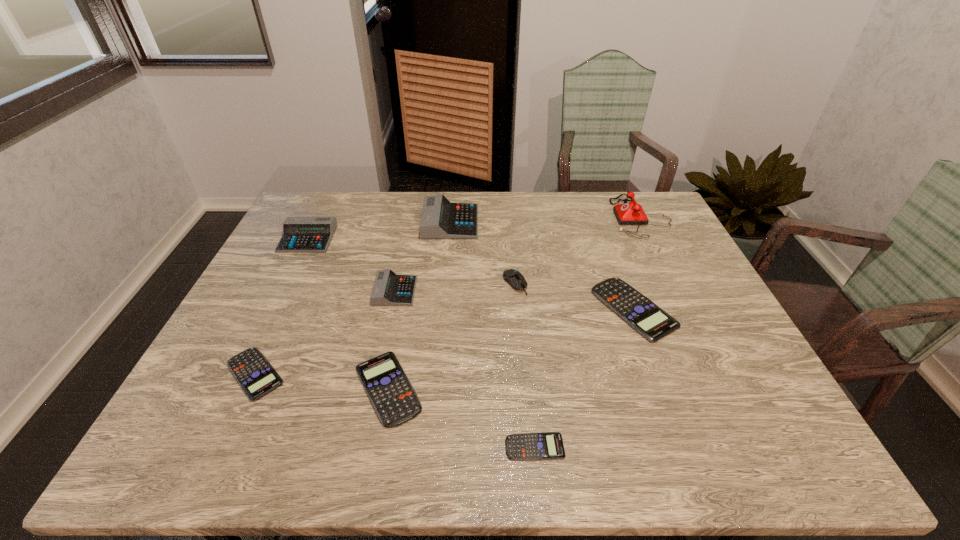
Image resolution: width=960 pixels, height=540 pixels. What are the coordinates of `the rightmost blue calculator` in the screenshot? It's located at (653, 323).

What are the coordinates of `the third smallest blue calculator` in the screenshot? It's located at (394, 400).

At what (x,y) coordinates should I click in order to perform the action: click on the third shortest calculator. Please return your answer as a coordinate pair (x, y). Looking at the image, I should click on [x=394, y=400].

Image resolution: width=960 pixels, height=540 pixels. What are the coordinates of `the third biggest blue calculator` in the screenshot? It's located at (253, 372).

In order to click on the eighth tallest object in this screenshot , I will do `click(253, 372)`.

This screenshot has height=540, width=960. I want to click on the shortest object, so click(x=528, y=446).

The height and width of the screenshot is (540, 960). What are the coordinates of `the third blue calculator from left to right` in the screenshot? It's located at (528, 446).

Locate an element on the screen. Image resolution: width=960 pixels, height=540 pixels. free space located on the dial of the tallest object is located at coordinates (597, 217).

Locate an element on the screen. The width and height of the screenshot is (960, 540). free space located on the dial of the tallest object is located at coordinates (574, 217).

Locate an element on the screen. The width and height of the screenshot is (960, 540). free space located 0.280m on the dial of the tallest object is located at coordinates (530, 217).